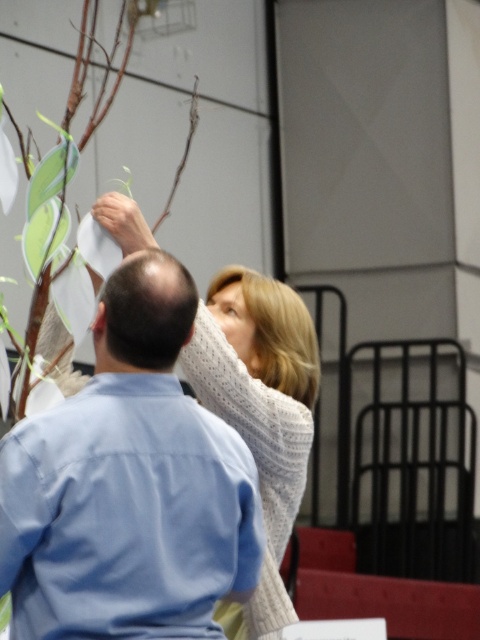
Measure the distance from blue cotton shirt at upper left to brown matte branch at upper center.

They are 1.31 meters apart.

Between blue cotton shirt at upper left and brown matte branch at upper center, which one has more height?

Standing taller between the two is blue cotton shirt at upper left.

Who is more distant from viewer, (131, 330) or (169, 198)?

The point (169, 198) is more distant.

You are a GUI agent. You are given a task and a screenshot of the screen. Output one action in this format:
    pyautogui.click(x=<x>, y=<y>)
    Task: Click on the blue cotton shirt at upper left
    
    Given the screenshot: What is the action you would take?
    pyautogui.click(x=129, y=484)